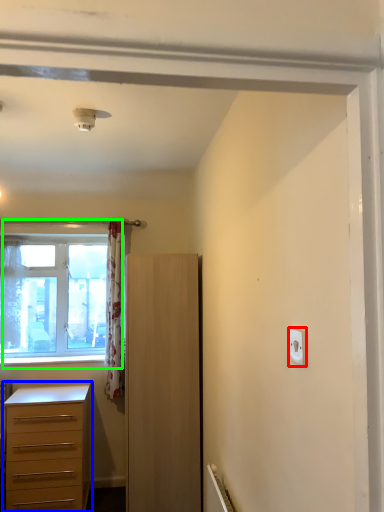
Question: Estimate the real-world distances between objects in this image. Which object is farther from light switch (highlighted by a red box), chest of drawers (highlighted by a blue box) or window (highlighted by a green box)?

Choices:
 (A) chest of drawers
 (B) window

Answer: (B)